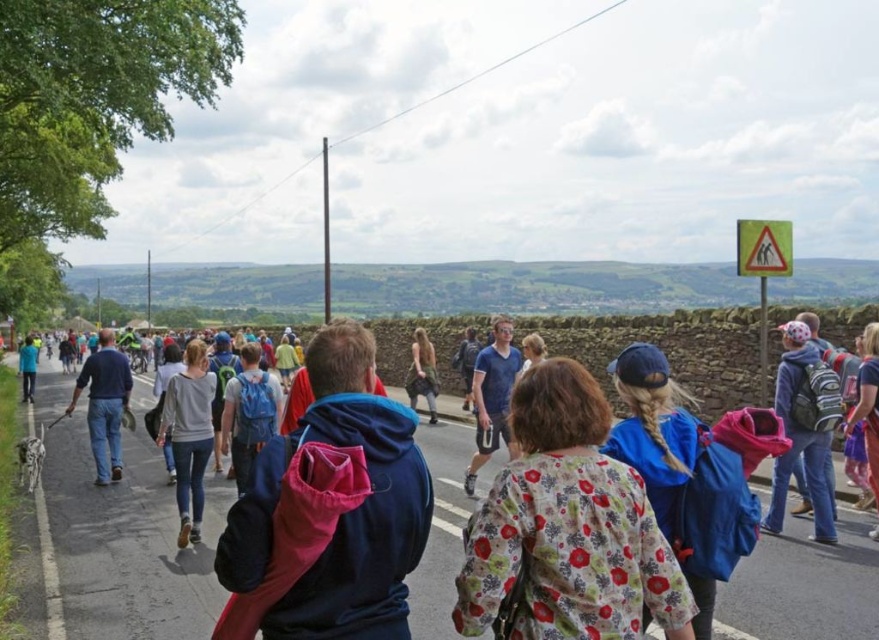
Question: Among these objects, which one is farthest from the camera?

Choices:
 (A) blue hooded sweatshirt at center
 (B) floral fabric jacket at center

Answer: (A)

Question: Can you confirm if blue hooded sweatshirt at center is smaller than floral fabric jacket at center?

Choices:
 (A) yes
 (B) no

Answer: (B)

Question: Which point appears closest to the camera in this image?

Choices:
 (A) (725, 586)
 (B) (554, 472)

Answer: (B)

Question: Is blue hooded sweatshirt at center further to the viewer compared to floral fabric jacket at center?

Choices:
 (A) no
 (B) yes

Answer: (B)

Question: Does blue hooded sweatshirt at center appear under floral fabric jacket at center?

Choices:
 (A) yes
 (B) no

Answer: (A)